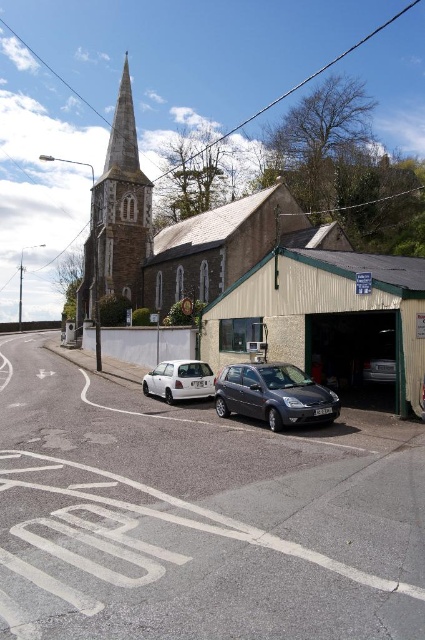
Between stone church steeple at upper left and metallic gray hatchback at center, which one has less height?

With less height is metallic gray hatchback at center.

Describe the element at coordinates (169, 232) in the screenshot. This screenshot has height=640, width=425. I see `stone church steeple at upper left` at that location.

The image size is (425, 640). Identify the location of stone church steeple at upper left. (169, 232).

Which is below, smooth stone spire at upper left or metallic silver car at center?

Positioned lower is metallic silver car at center.

The image size is (425, 640). Identify the location of smooth stone spire at upper left. click(116, 216).

This screenshot has width=425, height=640. Find the location of `smooth stone spire at upper left`. smooth stone spire at upper left is located at coordinates (116, 216).

Is metallic/greenish garage at lower right closer to camera compared to smooth stone spire at upper left?

Yes, metallic/greenish garage at lower right is closer to the viewer.

Does metallic/greenish garage at lower right come behind smooth stone spire at upper left?

No, metallic/greenish garage at lower right is closer to the viewer.

Where is `metallic/greenish garage at lower right`? The image size is (425, 640). metallic/greenish garage at lower right is located at coordinates (329, 321).